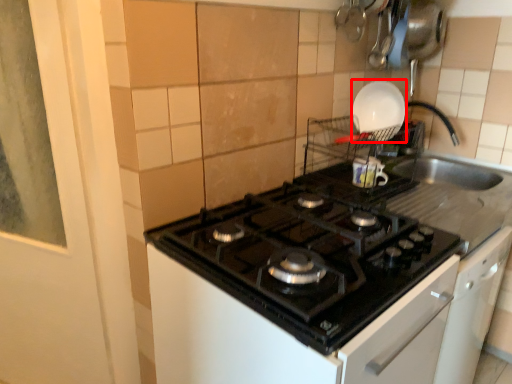
Question: From the image's perspective, what is the correct spatial positioning of kitchen appliance (annotated by the red box) in reference to gas stove?

Choices:
 (A) above
 (B) below

Answer: (A)